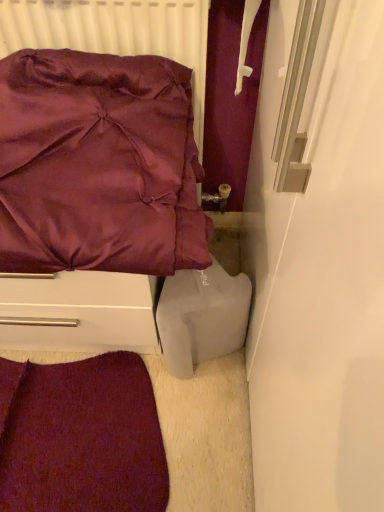
Question: Is matte white radiator at upper left not within velvet carpet at lower left?

Choices:
 (A) yes
 (B) no

Answer: (A)

Question: Is matte white radiator at upper left to the right of velvet carpet at lower left from the viewer's perspective?

Choices:
 (A) yes
 (B) no

Answer: (A)

Question: Is velvet carpet at lower left inside matte white radiator at upper left?

Choices:
 (A) no
 (B) yes

Answer: (A)

Question: Is matte white radiator at upper left shorter than velvet carpet at lower left?

Choices:
 (A) yes
 (B) no

Answer: (B)

Question: Considering the relative sizes of matte white radiator at upper left and velvet carpet at lower left in the image provided, is matte white radiator at upper left thinner than velvet carpet at lower left?

Choices:
 (A) no
 (B) yes

Answer: (B)

Question: Can you confirm if matte white radiator at upper left is positioned to the left of velvet carpet at lower left?

Choices:
 (A) no
 (B) yes

Answer: (A)

Question: Does satin purple pillow at upper left appear on the left side of white matte plastic container at lower right?

Choices:
 (A) no
 (B) yes

Answer: (B)

Question: Is satin purple pillow at upper left outside white matte plastic container at lower right?

Choices:
 (A) no
 (B) yes

Answer: (B)

Question: From the image's perspective, is satin purple pillow at upper left located above white matte plastic container at lower right?

Choices:
 (A) yes
 (B) no

Answer: (A)

Question: Is satin purple pillow at upper left oriented away from white matte plastic container at lower right?

Choices:
 (A) yes
 (B) no

Answer: (B)

Question: Considering the relative sizes of satin purple pillow at upper left and white matte plastic container at lower right in the image provided, is satin purple pillow at upper left bigger than white matte plastic container at lower right?

Choices:
 (A) no
 (B) yes

Answer: (B)

Question: Would you consider satin purple pillow at upper left to be distant from white matte plastic container at lower right?

Choices:
 (A) yes
 (B) no

Answer: (B)

Question: Considering the relative sizes of white matte plastic container at lower right and matte white radiator at upper left in the image provided, is white matte plastic container at lower right wider than matte white radiator at upper left?

Choices:
 (A) no
 (B) yes

Answer: (B)